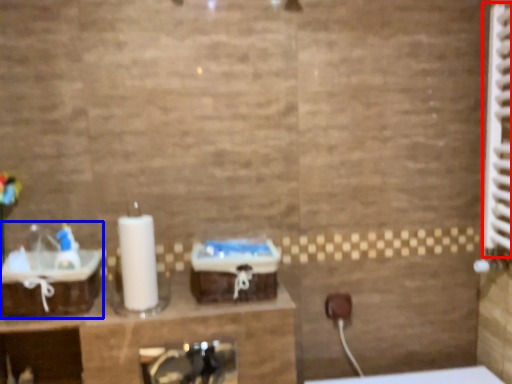
Question: Among these objects, which one is nearest to the camera, radiator (highlighted by a red box) or sink (highlighted by a blue box)?

Choices:
 (A) radiator
 (B) sink

Answer: (A)